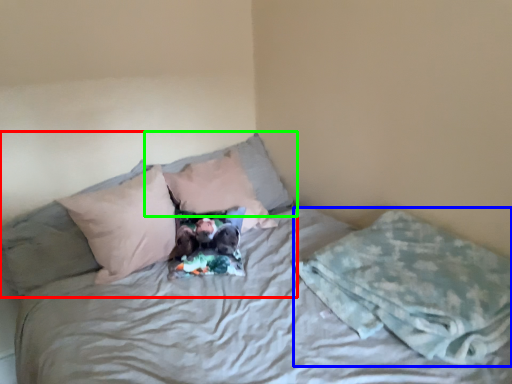
Question: Which is nearer to the pillow (highlighted by a red box)? blanket (highlighted by a blue box) or pillow (highlighted by a green box).

Choices:
 (A) blanket
 (B) pillow

Answer: (B)